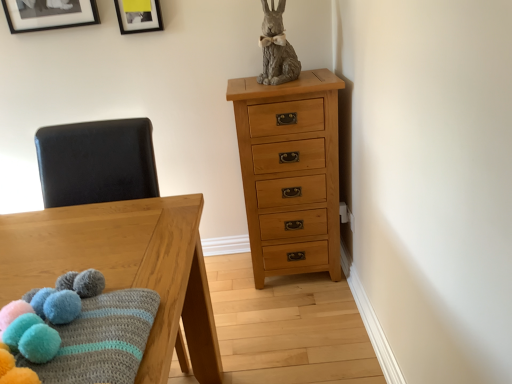
Question: Does black matte picture frame at upper left, placed as the second picture frame when sorted from right to left, have a larger size compared to wooden table at left?

Choices:
 (A) yes
 (B) no

Answer: (B)

Question: Is black matte picture frame at upper left, acting as the first picture frame starting from the left, positioned behind wooden table at left?

Choices:
 (A) yes
 (B) no

Answer: (A)

Question: Considering the relative sizes of black matte picture frame at upper left, acting as the first picture frame starting from the left, and wooden table at left in the image provided, is black matte picture frame at upper left, acting as the first picture frame starting from the left, thinner than wooden table at left?

Choices:
 (A) yes
 (B) no

Answer: (A)

Question: Does black matte picture frame at upper left, placed as the second picture frame when sorted from right to left, have a greater height compared to wooden table at left?

Choices:
 (A) yes
 (B) no

Answer: (B)

Question: Is black matte picture frame at upper left, acting as the first picture frame starting from the left, looking in the opposite direction of wooden table at left?

Choices:
 (A) yes
 (B) no

Answer: (B)

Question: Would you say light brown wood chest of drawers at upper right is to the left or to the right of black matte picture frame at upper left, placed as the second picture frame when sorted from right to left, in the picture?

Choices:
 (A) right
 (B) left

Answer: (A)

Question: Is light brown wood chest of drawers at upper right spatially inside black matte picture frame at upper left, placed as the second picture frame when sorted from right to left, or outside of it?

Choices:
 (A) inside
 (B) outside

Answer: (B)

Question: In terms of size, does light brown wood chest of drawers at upper right appear bigger or smaller than black matte picture frame at upper left, acting as the first picture frame starting from the left?

Choices:
 (A) big
 (B) small

Answer: (A)

Question: From a real-world perspective, relative to black matte picture frame at upper left, acting as the first picture frame starting from the left, is light brown wood chest of drawers at upper right vertically above or below?

Choices:
 (A) below
 (B) above

Answer: (A)

Question: In the image, is black matte picture frame at upper left, placed as the second picture frame when sorted from right to left, on the left side or the right side of light brown wood chest of drawers at upper right?

Choices:
 (A) left
 (B) right

Answer: (A)

Question: Choose the correct answer: Is black matte picture frame at upper left, acting as the first picture frame starting from the left, inside light brown wood chest of drawers at upper right or outside it?

Choices:
 (A) inside
 (B) outside

Answer: (B)

Question: In terms of width, does black matte picture frame at upper left, acting as the first picture frame starting from the left, look wider or thinner when compared to light brown wood chest of drawers at upper right?

Choices:
 (A) wide
 (B) thin

Answer: (B)

Question: Considering the positions of point click(82, 4) and point click(239, 144), is point click(82, 4) closer or farther from the camera than point click(239, 144)?

Choices:
 (A) closer
 (B) farther

Answer: (A)

Question: Considering the positions of black matte picture frame at upper center, placed as the 1th picture frame when sorted from right to left, and black matte picture frame at upper left, acting as the first picture frame starting from the left, in the image, is black matte picture frame at upper center, placed as the 1th picture frame when sorted from right to left, taller or shorter than black matte picture frame at upper left, acting as the first picture frame starting from the left,?

Choices:
 (A) short
 (B) tall

Answer: (A)

Question: From a real-world perspective, is black matte picture frame at upper center, placed as the 1th picture frame when sorted from right to left, positioned above or below black matte picture frame at upper left, acting as the first picture frame starting from the left?

Choices:
 (A) above
 (B) below

Answer: (B)